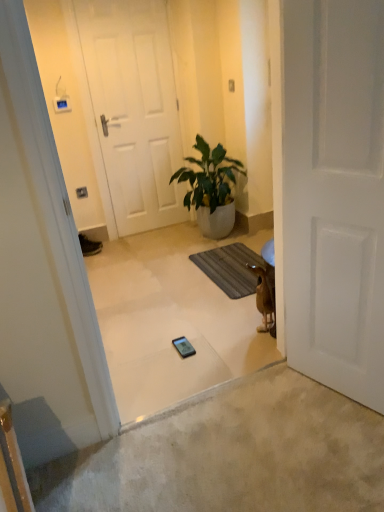
The height and width of the screenshot is (512, 384). I want to click on empty space that is ontop of brown textured bath mat at center (from a real-world perspective), so click(226, 259).